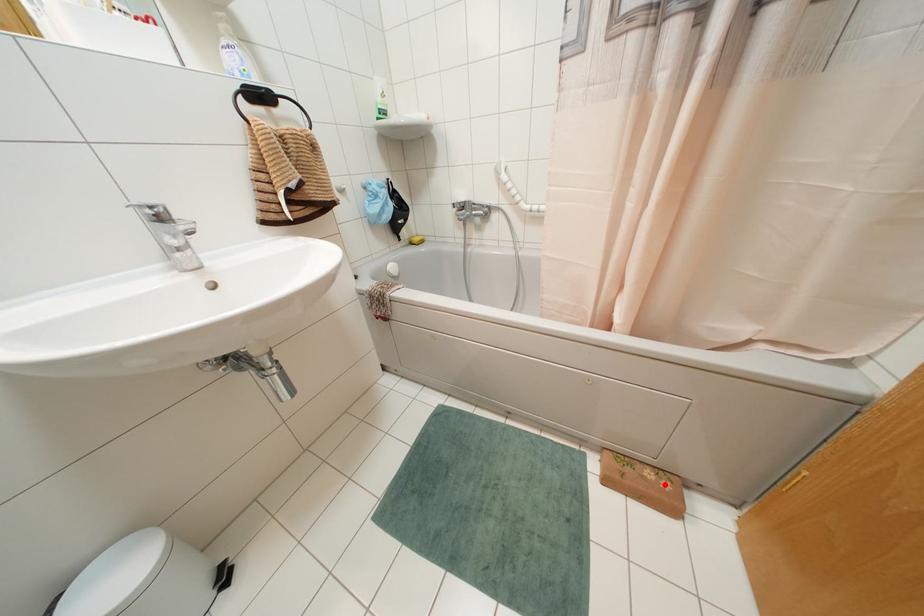
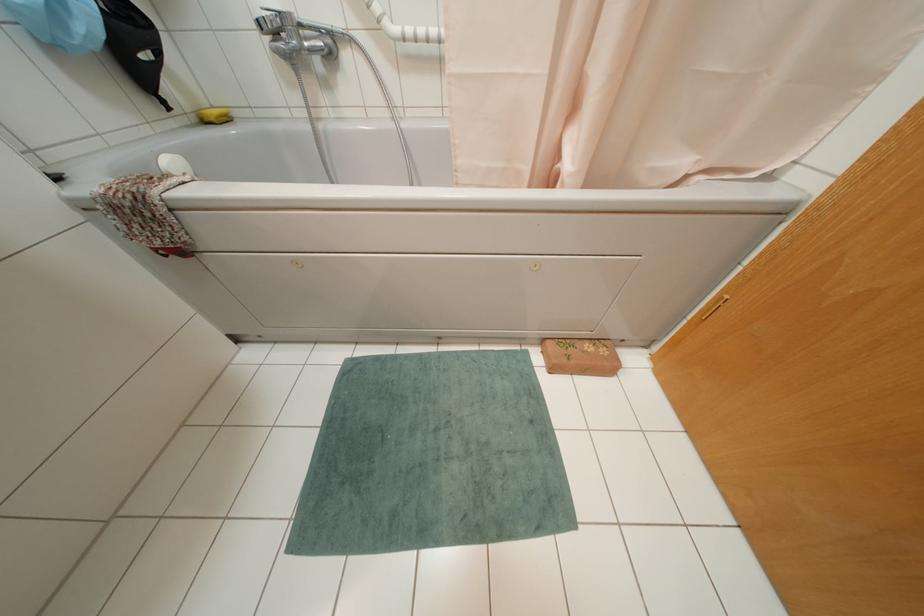
Where in the second image is the point corresponding to the highlighted location from the first image?

(602, 351)